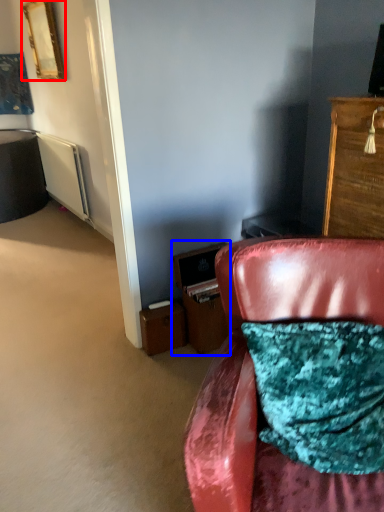
Question: Which object appears closest to the camera in this image, picture frame (highlighted by a red box) or file cabinet (highlighted by a blue box)?

Choices:
 (A) picture frame
 (B) file cabinet

Answer: (B)